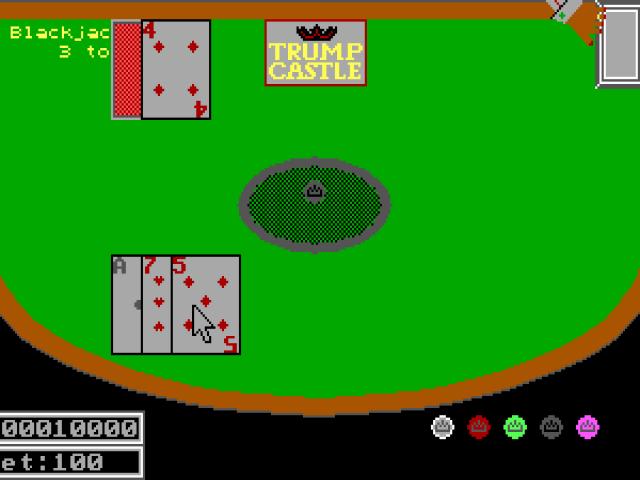
Identify the location of green table. The height and width of the screenshot is (480, 640). (515, 161).